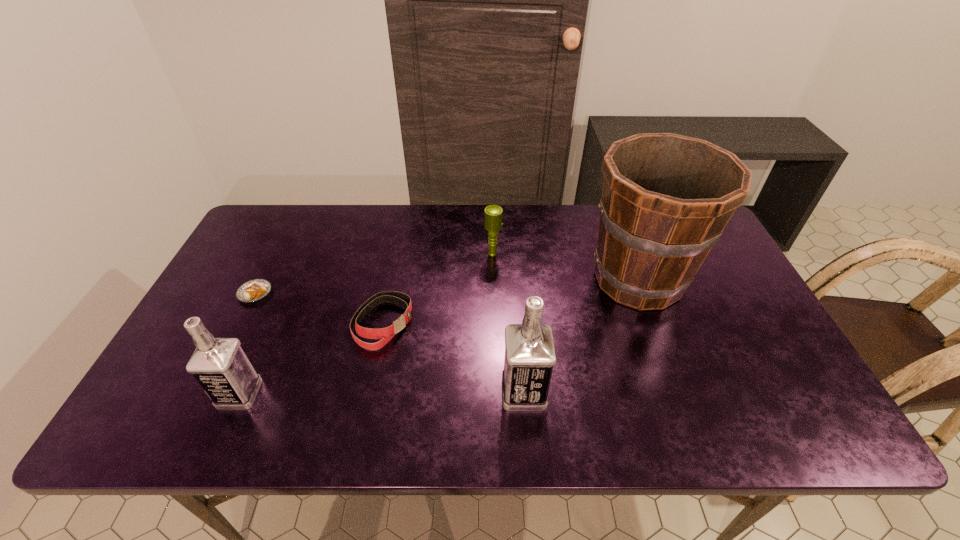
Image resolution: width=960 pixels, height=540 pixels. Identify the location of free space for a new vodka on the right. (806, 390).